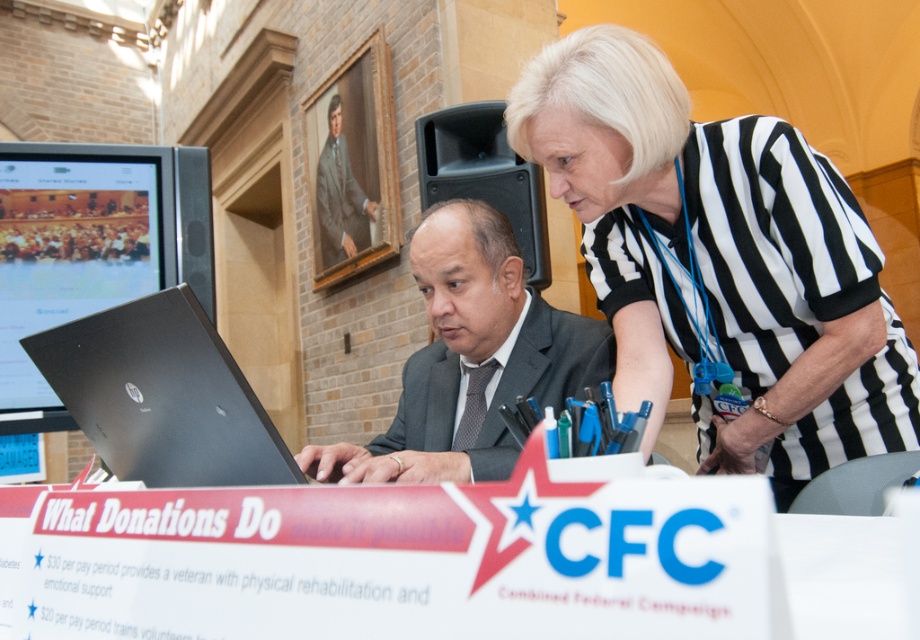
You are a photographer setting up for a professional event. You notice two suits in the frame, the dark gray suit at center and the brown textured suit at upper center. Which suit is closer to the camera?

The brown textured suit at upper center is closer to the camera since it is positioned above the dark gray suit at center.

You are attending a conference and need to present a slide from your laptop. You see the black matte laptop at center and the dark gray suit at center. Which object should you interact with to start your presentation?

The black matte laptop at center is in front of the dark gray suit at center, so you should interact with the black matte laptop at center to start your presentation.